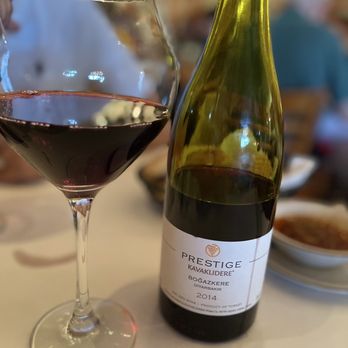
Image resolution: width=348 pixels, height=348 pixels. I want to click on stem on wine glass, so pyautogui.click(x=81, y=252).